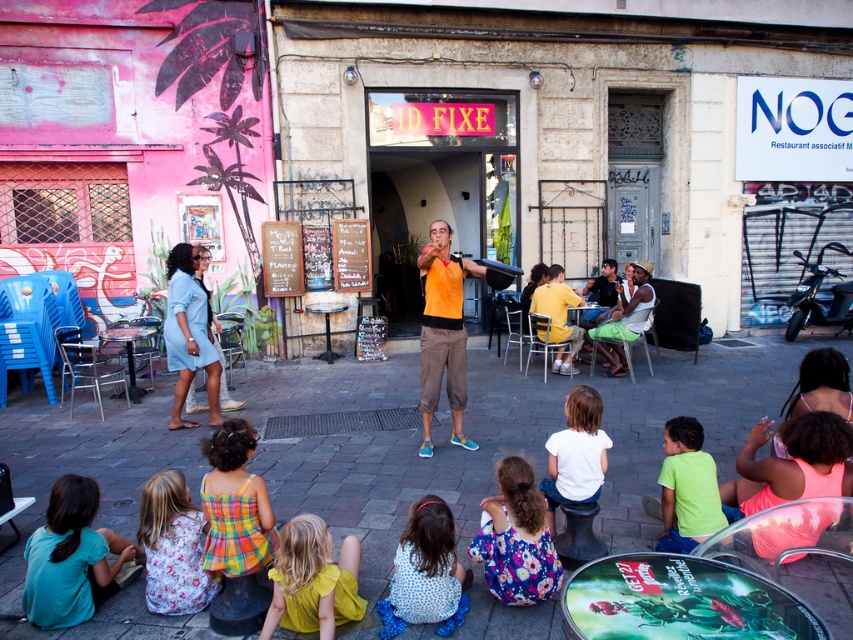
Question: Which point is farther to the camera?

Choices:
 (A) teal cotton shirt at lower left
 (B) orange cotton tank top at center
 (C) floral fabric dress at lower left

Answer: (B)

Question: Does floral fabric dress at lower left appear on the left side of neon green t-shirt at lower right?

Choices:
 (A) yes
 (B) no

Answer: (A)

Question: Among these objects, which one is farthest from the camera?

Choices:
 (A) yellow cotton shirt at center
 (B) matte yellow dress at lower center
 (C) matte orange shirt at center
 (D) floral fabric dress at lower left

Answer: (C)

Question: Can you confirm if polka dot fabric dress at lower center is bigger than orange fabric shirt at center?

Choices:
 (A) yes
 (B) no

Answer: (B)

Question: Among these points, which one is farthest from the camera?

Choices:
 (A) (363, 604)
 (B) (183, 550)

Answer: (B)

Question: Does orange cotton tank top at center have a smaller size compared to white cotton shirt at lower center?

Choices:
 (A) yes
 (B) no

Answer: (B)